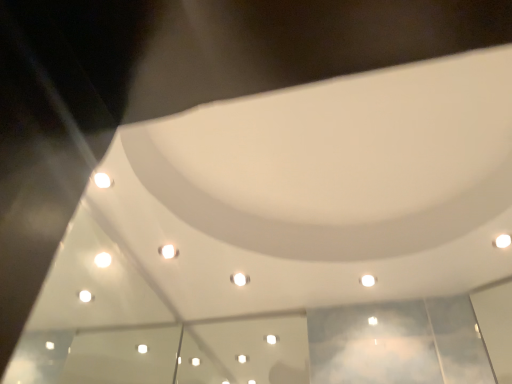
Question: Is white glossy light at upper right, the 1th light positioned from the top, to the left or to the right of white glossy light at center, the first light viewed from the left, in the image?

Choices:
 (A) left
 (B) right

Answer: (B)

Question: Would you say white glossy light at upper right, the 3th light viewed from the left, is inside or outside white glossy light at center, which is the third light in top-to-bottom order?

Choices:
 (A) inside
 (B) outside

Answer: (B)

Question: Based on their relative distances, which object is farther from the white glossy light at upper right, which appears as the 1th light when viewed from the front?

Choices:
 (A) white glossy light at upper center, which is the 2th light from back to front
 (B) white glossy light at center, the first light viewed from the left

Answer: (B)

Question: Estimate the real-world distances between objects in this image. Which object is farther from the white glossy light at center, which is the third light in top-to-bottom order?

Choices:
 (A) white glossy light at upper center, which is counted as the 2th light, starting from the top
 (B) white glossy light at upper right, the third light positioned from the bottom

Answer: (B)